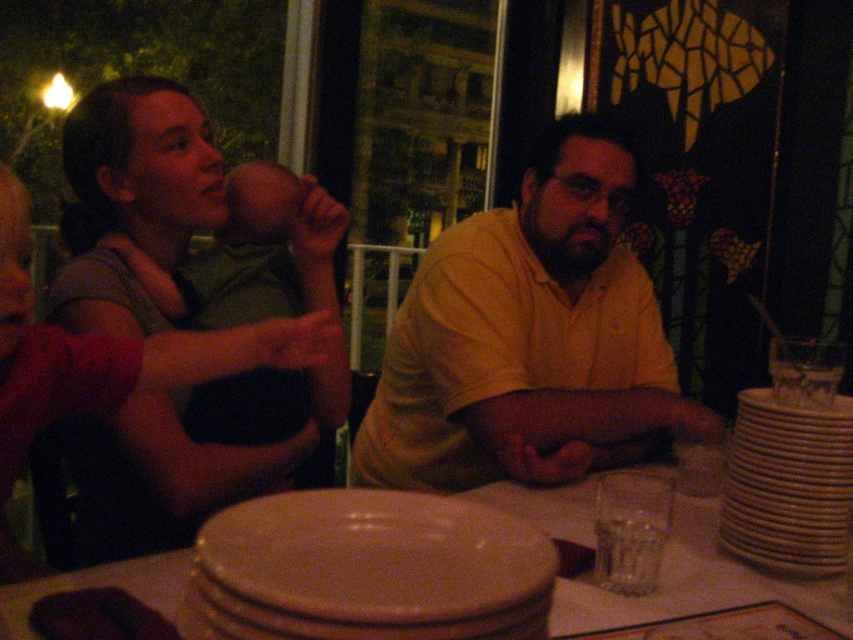
Can you confirm if matte ceramic plate at center is wider than matte ceramic plates at center?

No, matte ceramic plate at center is not wider than matte ceramic plates at center.

Where is `matte ceramic plate at center`? Image resolution: width=853 pixels, height=640 pixels. matte ceramic plate at center is located at coordinates click(368, 568).

How much distance is there between yellow matte shirt at center and white ceramic stack at right?

yellow matte shirt at center and white ceramic stack at right are 50.78 centimeters apart from each other.

Does yellow matte shirt at center have a greater height compared to white ceramic stack at right?

Yes.

What do you see at coordinates (529, 337) in the screenshot? I see `yellow matte shirt at center` at bounding box center [529, 337].

The width and height of the screenshot is (853, 640). Identify the location of yellow matte shirt at center. (529, 337).

Which is in front, point (216, 506) or point (793, 556)?

Point (793, 556) is in front.

Locate an element on the screen. Image resolution: width=853 pixels, height=640 pixels. matte green shirt at left is located at coordinates [134, 205].

Where is `matte green shirt at left`? This screenshot has height=640, width=853. matte green shirt at left is located at coordinates (134, 205).